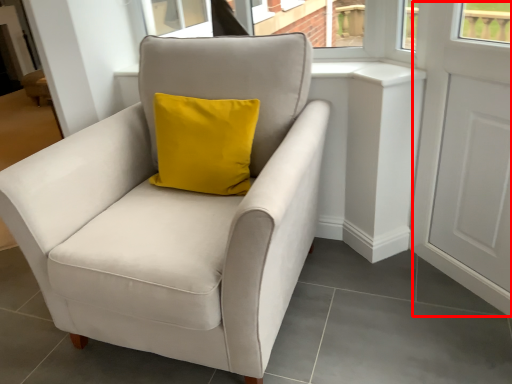
Question: Observing the image, what is the correct spatial positioning of screen door (annotated by the red box) in reference to chair?

Choices:
 (A) right
 (B) left

Answer: (A)